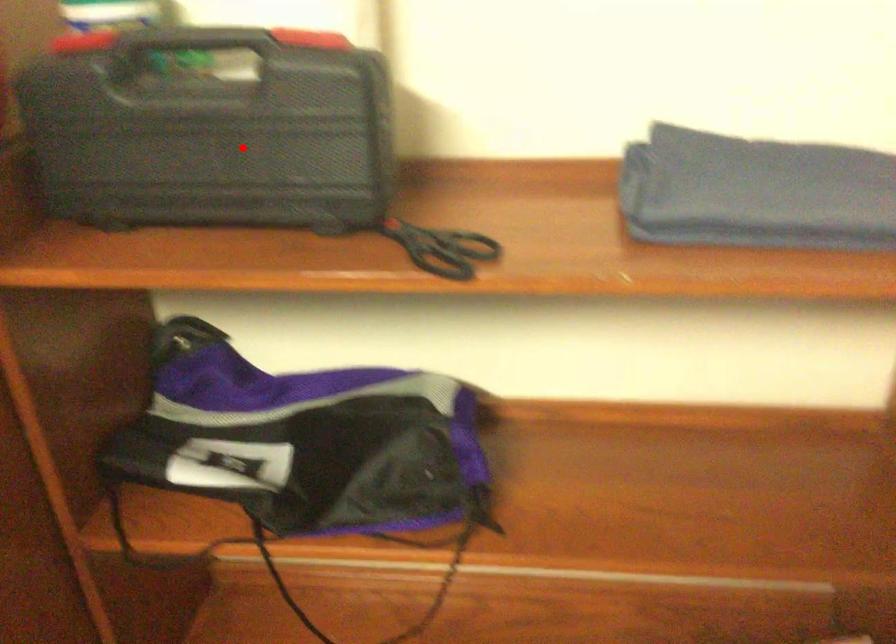
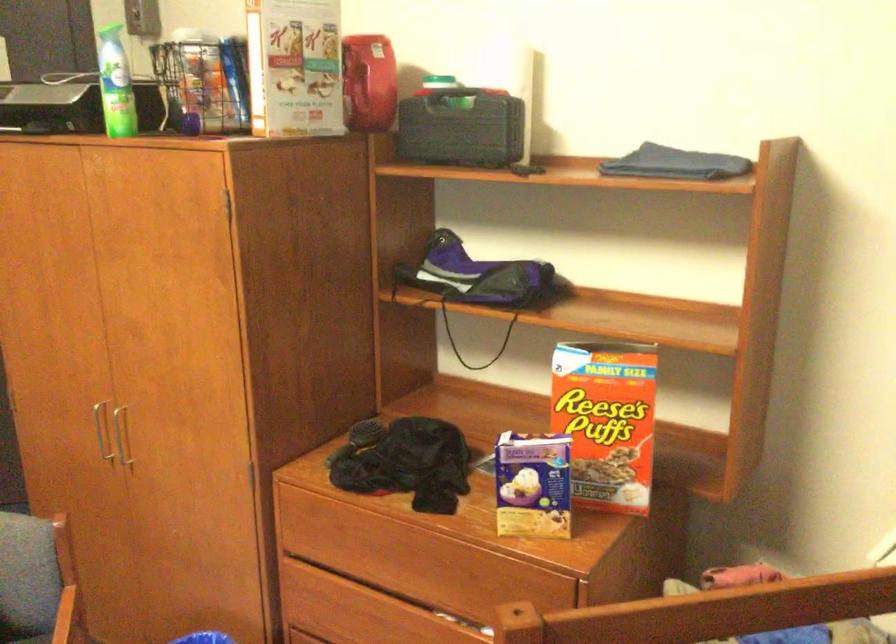
Locate, in the second image, the point that corresponds to the highlighted location in the first image.

(461, 128)